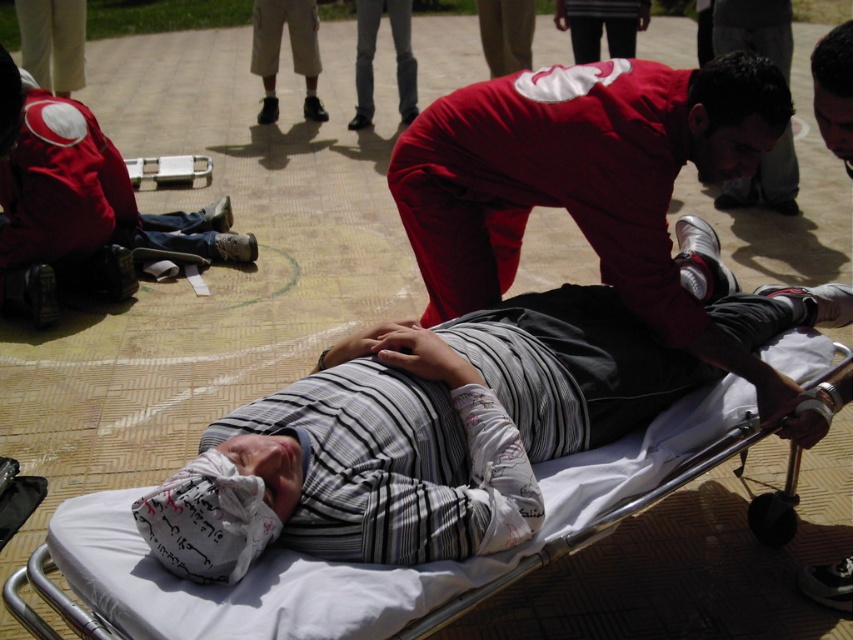
Question: Which point is farther to the camera?

Choices:
 (A) matte red uniform at center
 (B) white fabric stretcher at center
 (C) matte red backpack at upper left
 (D) striped fabric shirt at center

Answer: (C)

Question: Considering the real-world distances, which object is farthest from the matte red backpack at upper left?

Choices:
 (A) striped fabric shirt at center
 (B) matte red uniform at center
 (C) white fabric stretcher at center

Answer: (A)

Question: Among these objects, which one is farthest from the camera?

Choices:
 (A) white fabric stretcher at center
 (B) matte red uniform at center
 (C) striped fabric shirt at center
 (D) matte red backpack at upper left

Answer: (D)

Question: Is matte red uniform at center further to the viewer compared to white fabric stretcher at center?

Choices:
 (A) no
 (B) yes

Answer: (B)

Question: Does matte red uniform at center have a lesser width compared to striped fabric shirt at center?

Choices:
 (A) no
 (B) yes

Answer: (A)

Question: Is matte red backpack at upper left below striped fabric shirt at center?

Choices:
 (A) no
 (B) yes

Answer: (A)